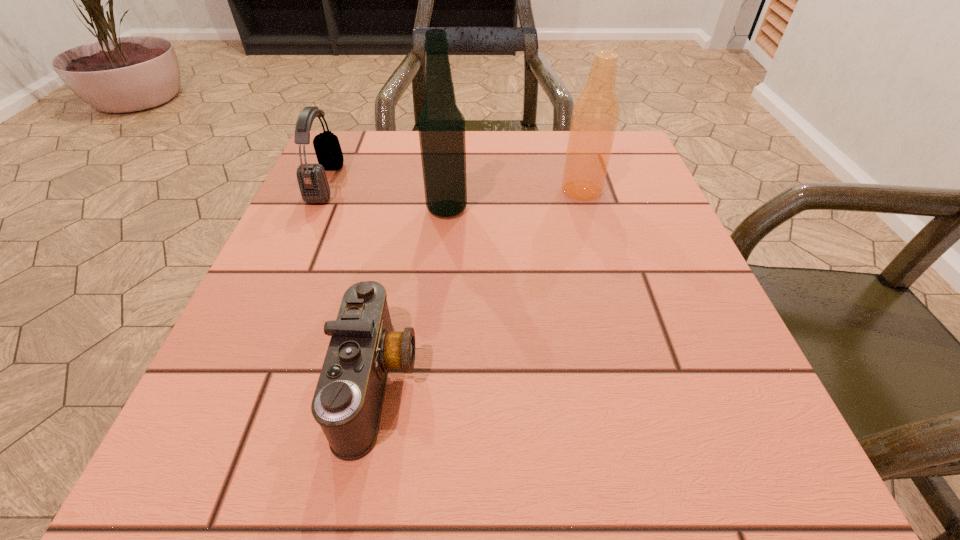
Identify the location of object that stands as the closest to the shortest object. The image size is (960, 540). (441, 125).

You are a GUI agent. You are given a task and a screenshot of the screen. Output one action in this format:
    pyautogui.click(x=<x>, y=<y>)
    Task: Click on the object that is the second closest to the camera
    This screenshot has width=960, height=540.
    Given the screenshot: What is the action you would take?
    pyautogui.click(x=312, y=180)

I want to click on free location that satisfies the following two spatial constraints: 1. on the back side of the alcohol; 2. on the headband of the headset, so click(449, 183).

In order to click on blank space that satisfies the following two spatial constraints: 1. on the headband of the beer bottle; 2. on the left side of the leftmost object in this screenshot , I will do `click(323, 190)`.

Where is `free spot that satisfies the following two spatial constraints: 1. on the headband of the rightmost object; 2. on the left side of the headset`? The height and width of the screenshot is (540, 960). free spot that satisfies the following two spatial constraints: 1. on the headband of the rightmost object; 2. on the left side of the headset is located at coordinates (323, 190).

You are a GUI agent. You are given a task and a screenshot of the screen. Output one action in this format:
    pyautogui.click(x=<x>, y=<y>)
    Task: Click on the free location that satisfies the following two spatial constraints: 1. on the headband of the leftmost object; 2. on the left side of the second tallest object
    This screenshot has height=540, width=960.
    Given the screenshot: What is the action you would take?
    pyautogui.click(x=323, y=190)

At what (x,y) coordinates should I click in order to perform the action: click on free space that satisfies the following two spatial constraints: 1. on the headband of the second shortest object; 2. on the right side of the alcohol. Please return your answer as a coordinate pair (x, y). This screenshot has height=540, width=960. Looking at the image, I should click on (314, 209).